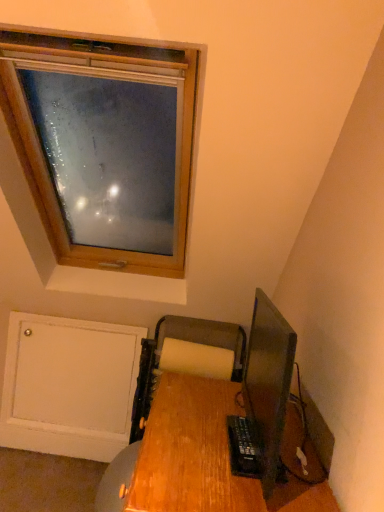
Question: Considering the positions of point coord(230,345) and point coord(253,422), is point coord(230,345) closer or farther from the camera than point coord(253,422)?

Choices:
 (A) farther
 (B) closer

Answer: (A)

Question: Looking at their shapes, would you say wooden printer at lower center is wider or thinner than matte black monitor at lower right?

Choices:
 (A) thin
 (B) wide

Answer: (B)

Question: Which object is the closest to the matte black monitor at lower right?

Choices:
 (A) wooden desk at lower right
 (B) wooden printer at lower center

Answer: (B)

Question: Based on their relative distances, which object is nearer to the wooden desk at lower right?

Choices:
 (A) matte black monitor at lower right
 (B) wooden printer at lower center

Answer: (B)